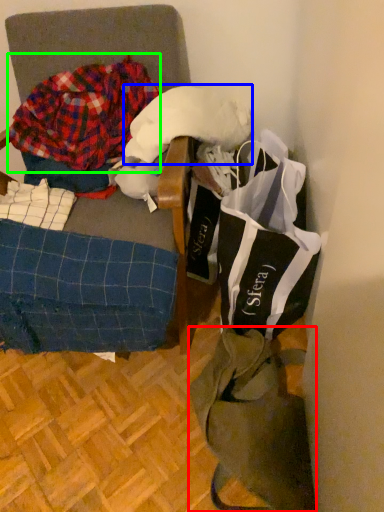
Question: Estimate the real-world distances between objects in this image. Which object is farther from tote bag (highlighted by a red box), wool (highlighted by a blue box) or flannel (highlighted by a green box)?

Choices:
 (A) wool
 (B) flannel

Answer: (B)